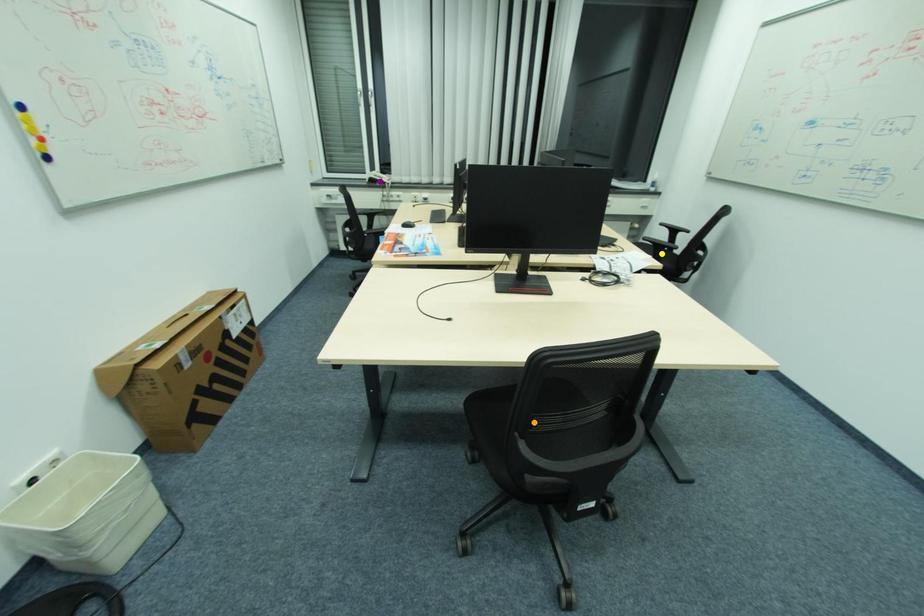
Order these from nearest to farthest:
- orange point
- yellow point
- purple point

orange point < yellow point < purple point